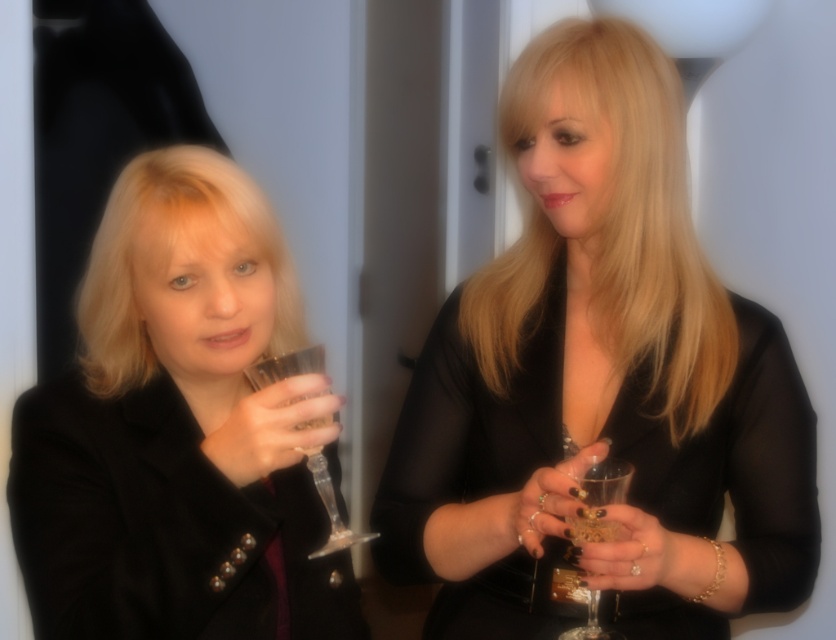
You are at a party and want to place a small note on the clear glass wine glass at left without touching the black glossy dress at center. Is this possible?

The black glossy dress at center is positioned over the clear glass wine glass at left, so placing a note on the wine glass without touching the dress may not be possible due to the dress obstructing access.

You are at a formal event and need to exit through the door behind the black glossy dress at center. Can you step around the black matte jacket at left to reach the door?

The black matte jacket at left is behind the black glossy dress at center, so you can step around the black matte jacket at left to reach the door behind the black glossy dress at center.

You are at a party and need to place a small note on the table between the black glossy dress at center and the clear glass wine glass at left. Based on their positions, which object should you place the note closer to to ensure it doesn

The black glossy dress at center is to the right of the clear glass wine glass at left, so placing the note closer to the clear glass wine glass at left would keep it between them.